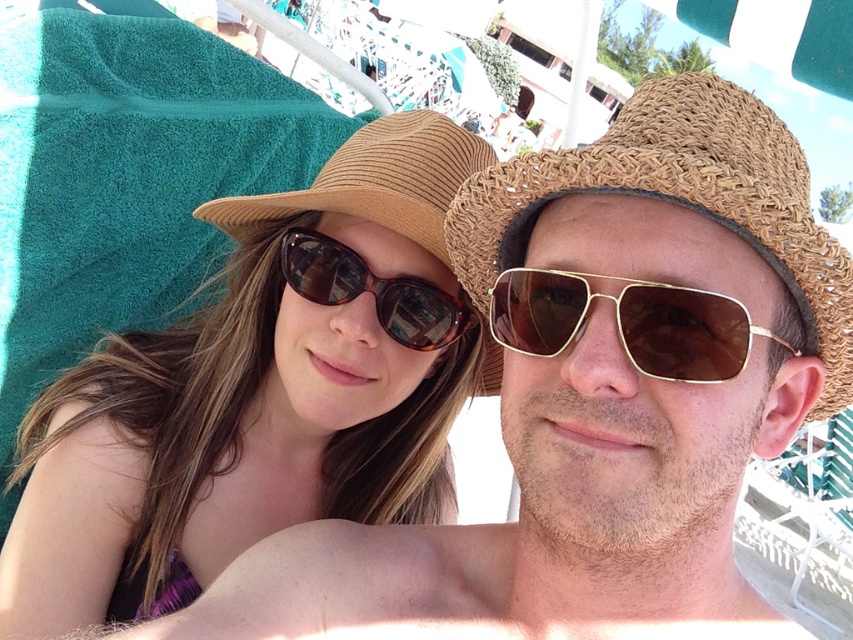
You are standing at the origin point in the image and want to reach the point labeled as point (416, 332). However, there is an obstacle at point (33, 634). Can you directly walk to your destination without going around the obstacle?

No, you cannot directly walk to point (416, 332) because the obstacle at point (33, 634) is in front of it. You will need to go around the obstacle to reach your destination.

You are a photographer trying to capture a closeup shot of both the woven straw hat at center and the brown tortoiseshell sunglasses at center. Since you want both items to appear equally sized in the photo, which object should you move closer to the camera?

The woven straw hat at center is bigger than the brown tortoiseshell sunglasses at center, so you should move the woven straw hat at center farther away from the camera to make it appear smaller, while keeping the brown tortoiseshell sunglasses at center closer to maintain its size. This way, both items will appear equally sized in the photo.